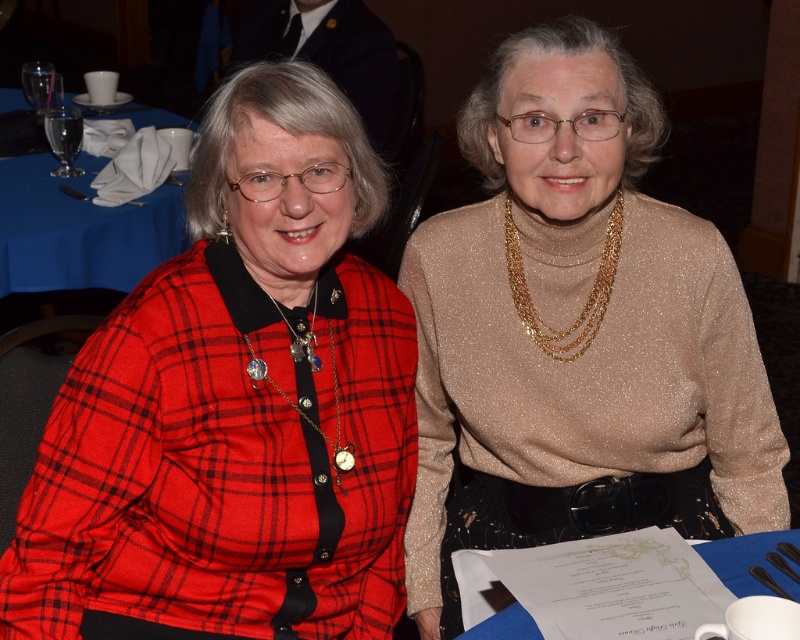
Question: Is red plaid shirt at left closer to the viewer compared to silver metallic chain with pendants at center?

Choices:
 (A) yes
 (B) no

Answer: (A)

Question: Considering the real-world distances, which object is farthest from the gold glitter sweater at center?

Choices:
 (A) blue cloth napkin at left
 (B) gold glittering necklace at center
 (C) silver metallic chain with pendants at center

Answer: (A)

Question: Which is farther from the gold glitter sweater at center?

Choices:
 (A) blue cloth napkin at left
 (B) gold glittering necklace at center

Answer: (A)

Question: Can you confirm if gold glitter sweater at center is positioned to the left of silver metallic chain with pendants at center?

Choices:
 (A) no
 (B) yes

Answer: (A)

Question: Does gold glitter sweater at center have a smaller size compared to blue cloth napkin at left?

Choices:
 (A) yes
 (B) no

Answer: (B)

Question: Which point is closer to the camera?

Choices:
 (A) silver metallic chain with pendants at center
 (B) gold glittering necklace at center

Answer: (A)